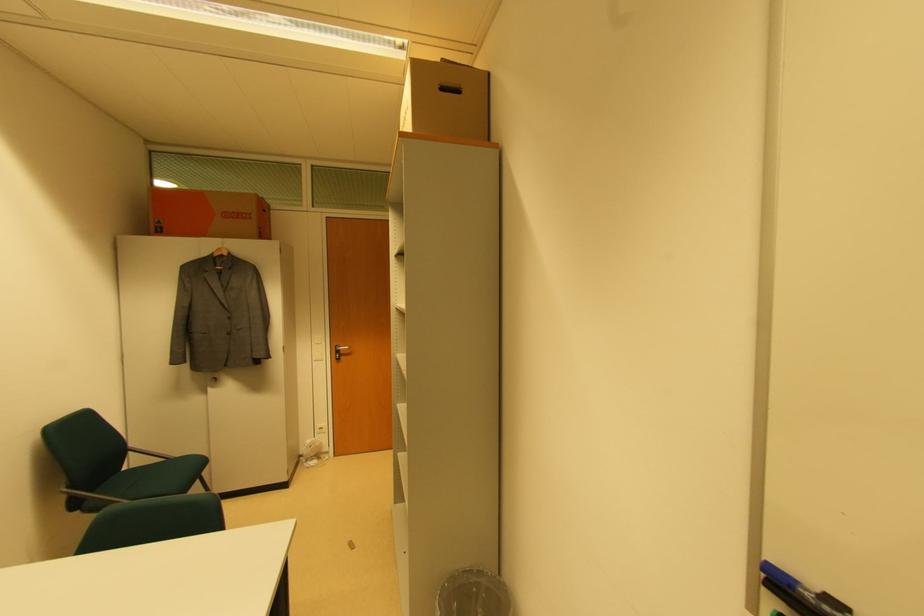
Find where to push the orange cardboard box. Please return your answer as a coordinate pair (x, y).

(208, 214)